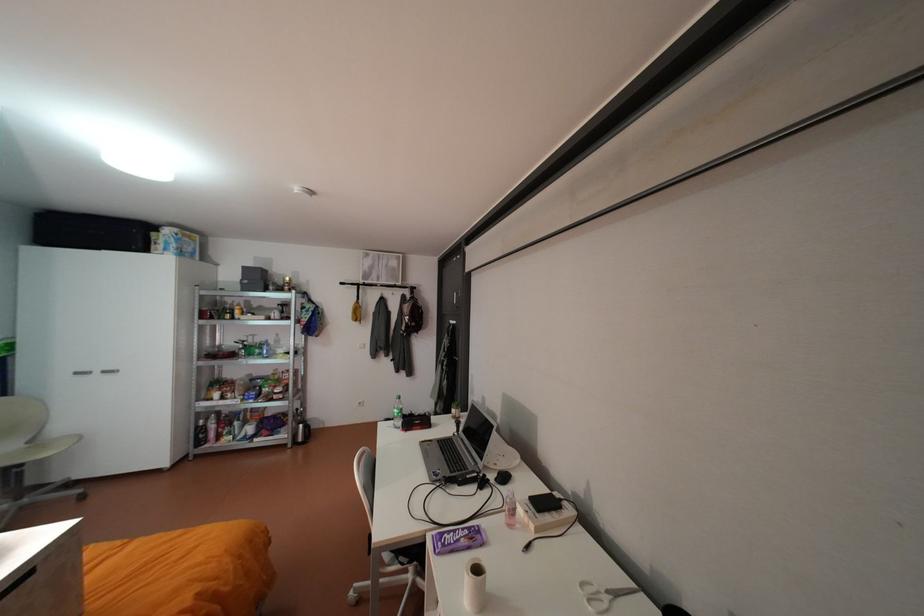
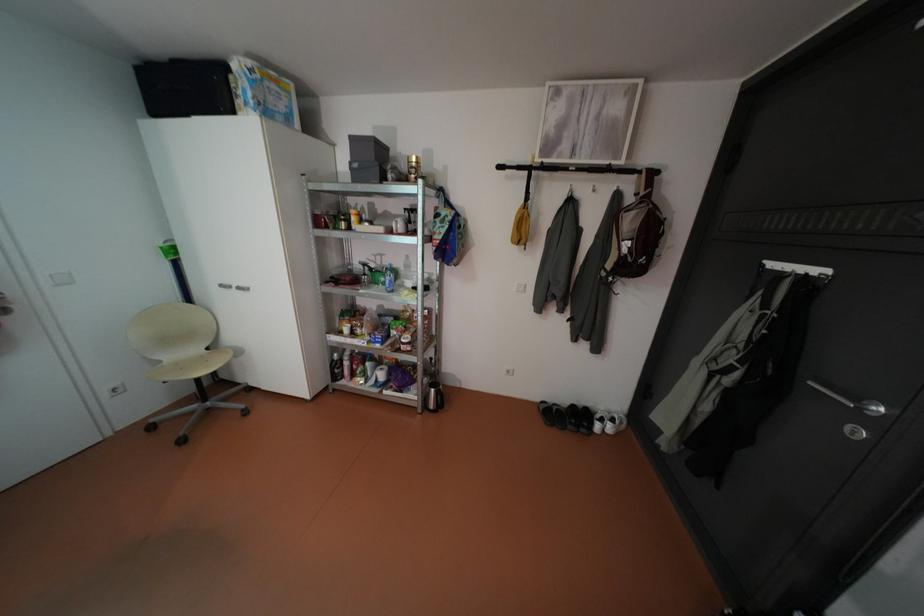
Locate, in the second image, the point that corresponds to the point at 254,281 in the first image.

(365, 164)